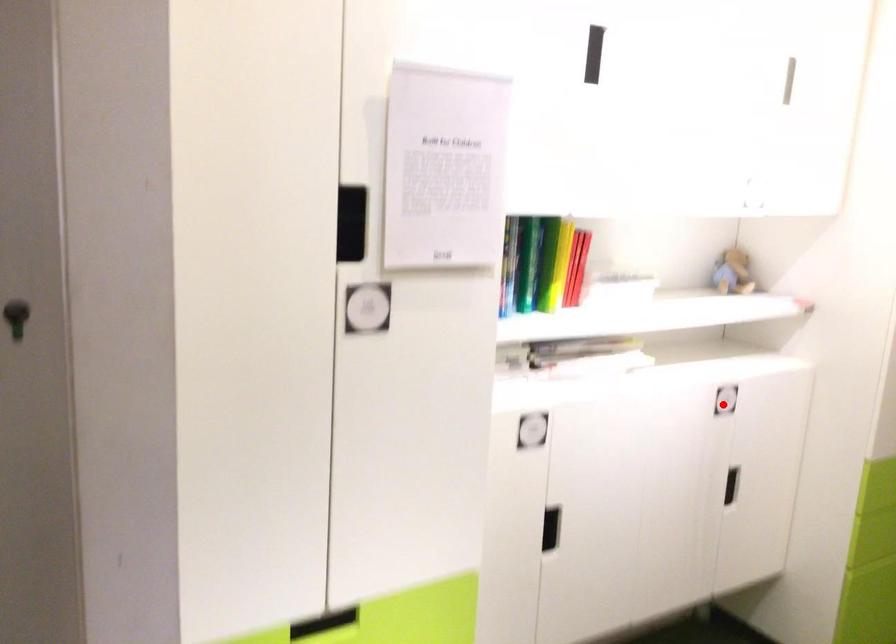
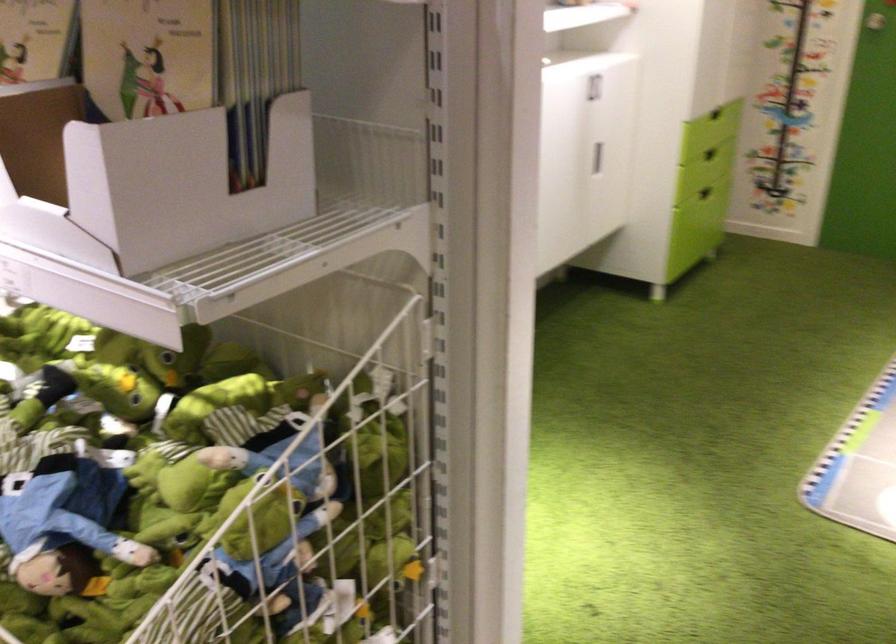
The point at the highlighted location is marked in the first image. Where is the corresponding point in the second image?

(593, 87)